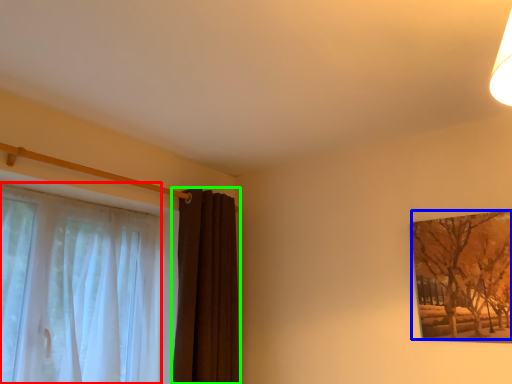
Question: Which object is the closest to the curtain (highlighted by a red box)? Choose among these: tree (highlighted by a blue box) or curtain (highlighted by a green box).

Choices:
 (A) tree
 (B) curtain

Answer: (B)